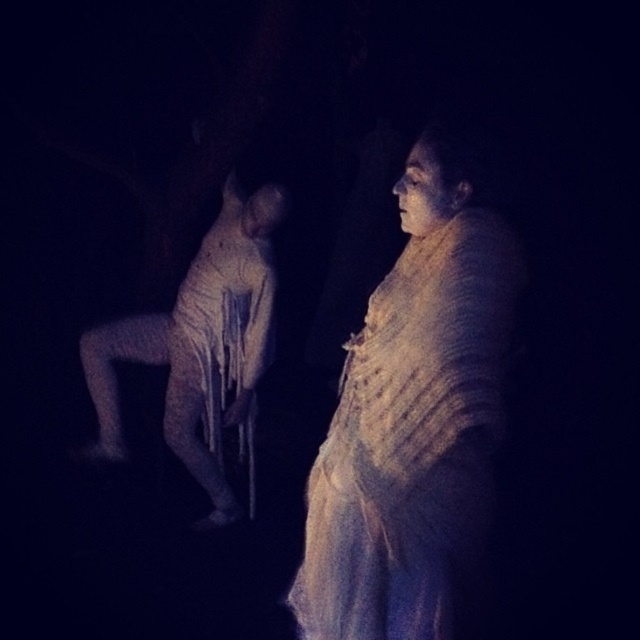
Between point (435, 403) and point (211, 426), which one is positioned behind?

The point (211, 426) is behind.

Between white textured dress at center and white textured crutches at left, which one appears on the left side from the viewer's perspective?

Positioned to the left is white textured crutches at left.

Is point (314, 604) positioned after point (186, 296)?

No, it is in front of (186, 296).

Find the location of a particular element. The image size is (640, 640). white textured dress at center is located at coordinates (416, 406).